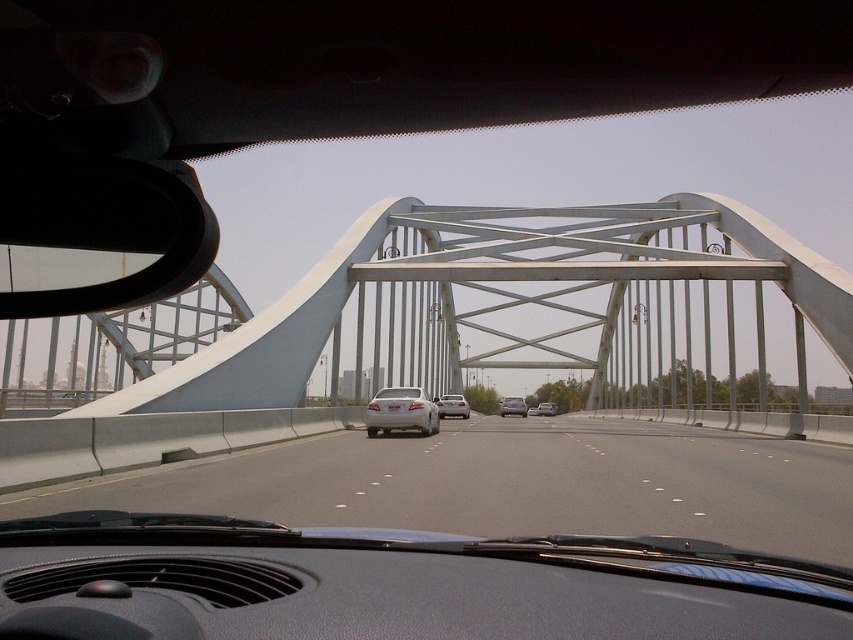
Question: Which object is positioned closest to the white metallic bridge at center?

Choices:
 (A) silver metallic sedan at center
 (B) white matte sedan at center
 (C) white glossy sedan at center
 (D) gray asphalt highway at center

Answer: (B)

Question: Does satin silver sedan at center have a larger size compared to silver metallic sedan at center?

Choices:
 (A) yes
 (B) no

Answer: (B)

Question: Which point is farther to the camera?

Choices:
 (A) 553,410
 (B) 386,404

Answer: (A)

Question: Is white metallic bridge at center to the left of gray asphalt highway at center from the viewer's perspective?

Choices:
 (A) no
 (B) yes

Answer: (B)

Question: Which point is closer to the camera?

Choices:
 (A) (544, 412)
 (B) (364, 401)
 (C) (518, 408)

Answer: (B)

Question: Where is white matte sedan at center located in relation to silver metallic sedan at center in the image?

Choices:
 (A) above
 (B) below

Answer: (A)